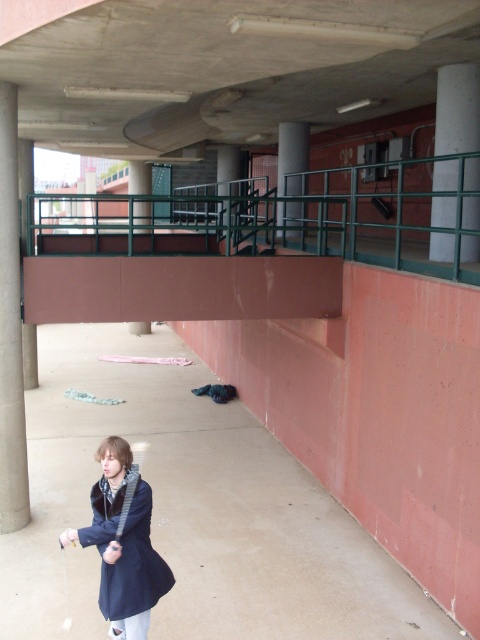
You are standing at point (474, 132) and want to walk to point (71, 412). Based on the scene description, is the destination point behind you or in front of you?

The destination point (71, 412) is behind you because according to the description, point (71, 412) is behind point (474, 132).

You are a delivery person needing to navigate between the concrete pillar at left and the brown concrete pillar at center. Which pillar should you avoid if you need to pass through a narrow space?

The concrete pillar at left has a smaller size compared to the brown concrete pillar at center, so you should avoid the brown concrete pillar at center because it is larger and may block the narrow space.